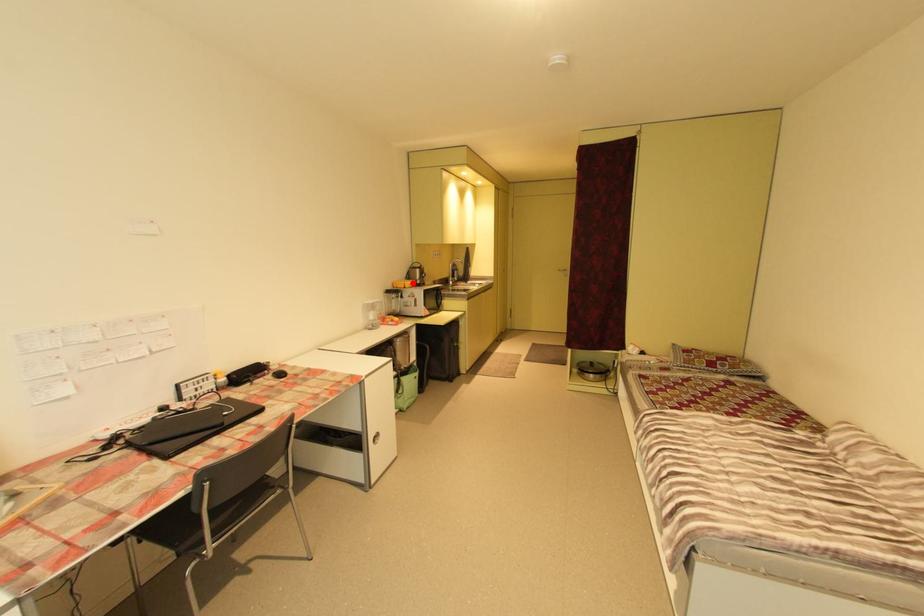
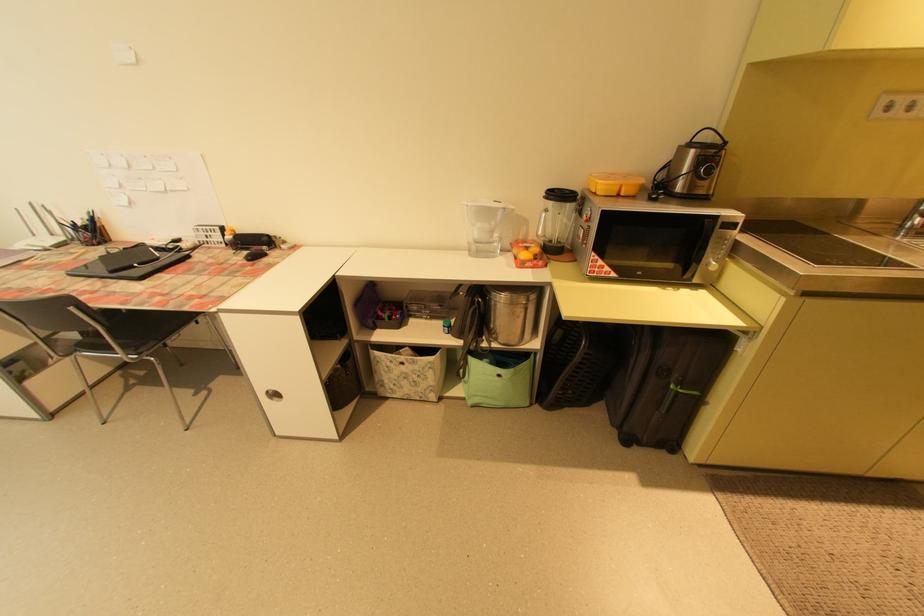
The point at the highlighted location is marked in the first image. Where is the corresponding point in the second image?

(610, 182)